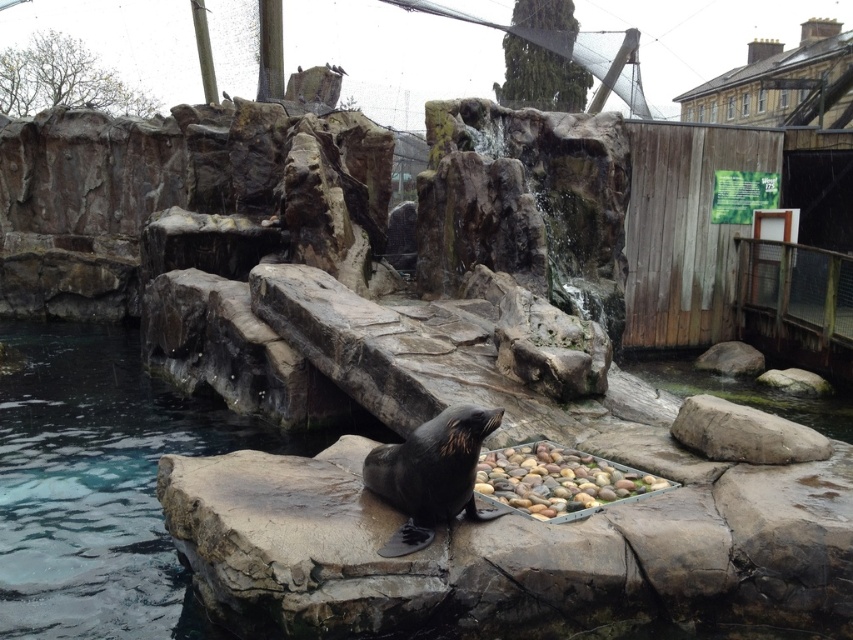
Question: Which point appears closest to the camera in this image?

Choices:
 (A) (677, 422)
 (B) (746, 364)
 (C) (521, 492)
 (D) (48, 449)

Answer: (C)

Question: From the image, what is the correct spatial relationship of gray rough rock at center in relation to smooth gray rock at center-right?

Choices:
 (A) below
 (B) above

Answer: (A)

Question: Can you confirm if clear water at rock bottom is bigger than gray rough rock at center?

Choices:
 (A) no
 (B) yes

Answer: (B)

Question: Is clear water at rock bottom bigger than smooth pebbles at center?

Choices:
 (A) no
 (B) yes

Answer: (B)

Question: Which point appears closest to the camera in this image?

Choices:
 (A) (x=225, y=419)
 (B) (x=572, y=518)
 (C) (x=680, y=438)

Answer: (B)

Question: Which of the following is the closest to the observer?

Choices:
 (A) smooth gray rock at center-right
 (B) gray rough rock at center
 (C) clear water at rock bottom
 (D) smooth pebbles at center

Answer: (C)